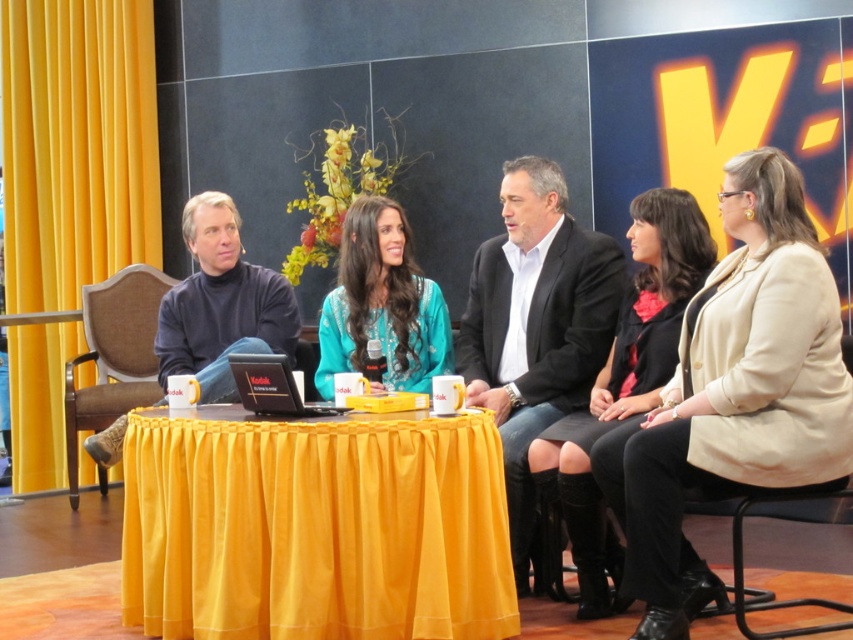
Is beige fabric jacket at right further to camera compared to dark blue turtleneck sweater at left?

No, beige fabric jacket at right is in front of dark blue turtleneck sweater at left.

Does beige fabric jacket at right have a lesser width compared to dark blue turtleneck sweater at left?

Yes, beige fabric jacket at right is thinner than dark blue turtleneck sweater at left.

Is point (767, 445) positioned before point (270, 324)?

That is True.

The height and width of the screenshot is (640, 853). In order to click on beige fabric jacket at right in this screenshot , I will do `click(735, 392)`.

Is point (595, 538) farther from viewer compared to point (227, 358)?

No.

Is point (590, 561) less distant than point (268, 388)?

No, (590, 561) is further to viewer.

Describe the element at coordinates (622, 387) in the screenshot. I see `black leather skirt at center` at that location.

At what (x,y) coordinates should I click in order to perform the action: click on black leather skirt at center. Please return your answer as a coordinate pair (x, y). This screenshot has height=640, width=853. Looking at the image, I should click on (622, 387).

Between point (271, 433) and point (380, 333), which one is positioned in front?

Point (271, 433)

Is yellow fabric table at center taller than turquoise fabric dress at center?

Incorrect, yellow fabric table at center's height is not larger of turquoise fabric dress at center's.

Between point (135, 577) and point (393, 268), which one is positioned in front?

Positioned in front is point (135, 577).

This screenshot has width=853, height=640. I want to click on yellow fabric table at center, so click(x=315, y=528).